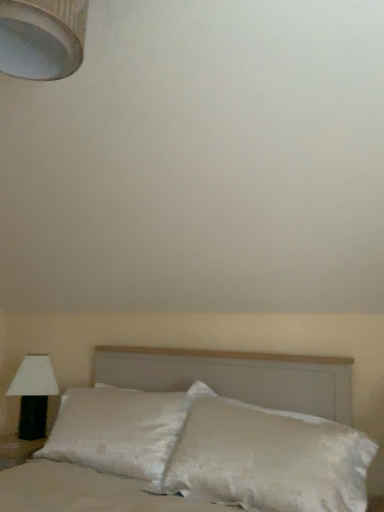
Question: From a real-world perspective, is white textured lampshade at upper left, positioned as the 1th lamp in front-to-back order, physically above white satin pillow at center?

Choices:
 (A) yes
 (B) no

Answer: (A)

Question: Does white textured lampshade at upper left, which is counted as the 2th lamp, starting from the back, have a greater height compared to white satin pillow at center?

Choices:
 (A) no
 (B) yes

Answer: (A)

Question: From the image's perspective, is white textured lampshade at upper left, the second lamp positioned from the bottom, above white satin pillow at center?

Choices:
 (A) no
 (B) yes

Answer: (B)

Question: Is white satin pillow at center completely or partially inside white textured lampshade at upper left, positioned as the 1th lamp in front-to-back order?

Choices:
 (A) yes
 (B) no

Answer: (B)

Question: Would you consider white textured lampshade at upper left, acting as the second lamp starting from the left, to be distant from white satin pillow at center?

Choices:
 (A) no
 (B) yes

Answer: (B)

Question: From a real-world perspective, is white textured lampshade at upper left, placed as the first lamp when sorted from right to left, positioned under white satin pillow at center based on gravity?

Choices:
 (A) yes
 (B) no

Answer: (B)

Question: Can you confirm if white satin pillow at center is positioned to the left of black fabric lamp at left, which is the 2th lamp in right-to-left order?

Choices:
 (A) yes
 (B) no

Answer: (B)

Question: Is black fabric lamp at left, which is the 1th lamp in back-to-front order, inside white satin pillow at center?

Choices:
 (A) yes
 (B) no

Answer: (B)

Question: Is white satin pillow at center turned away from black fabric lamp at left, which is the 1th lamp in back-to-front order?

Choices:
 (A) yes
 (B) no

Answer: (B)

Question: Can you confirm if white satin pillow at center is shorter than black fabric lamp at left, which is the 1th lamp in back-to-front order?

Choices:
 (A) yes
 (B) no

Answer: (B)

Question: Is white satin pillow at center outside black fabric lamp at left, which is the second lamp in top-to-bottom order?

Choices:
 (A) no
 (B) yes

Answer: (B)

Question: Is white satin pillow at center not close to black fabric lamp at left, which is the 1th lamp in back-to-front order?

Choices:
 (A) no
 (B) yes

Answer: (A)

Question: Considering the relative sizes of white satin pillow at center and white textured lampshade at upper left, which is the first lamp in top-to-bottom order, in the image provided, is white satin pillow at center thinner than white textured lampshade at upper left, which is the first lamp in top-to-bottom order,?

Choices:
 (A) yes
 (B) no

Answer: (B)